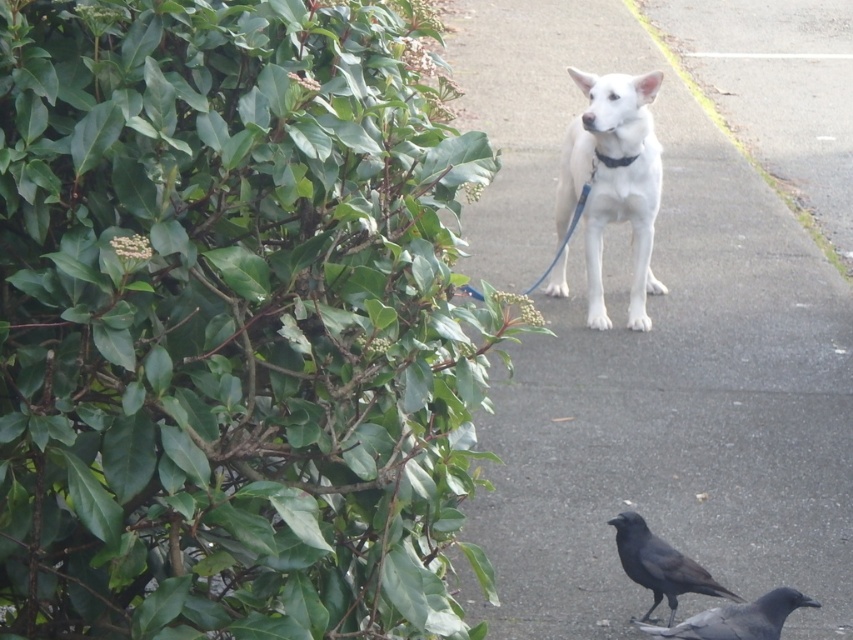
Between green leafy hedge at upper left and gray matte pigeon at lower right, which one appears on the right side from the viewer's perspective?

gray matte pigeon at lower right is more to the right.

Who is more distant from viewer, (415, 227) or (657, 628)?

Positioned behind is point (657, 628).

Is point (4, 416) closer to viewer compared to point (761, 605)?

That is True.

This screenshot has width=853, height=640. I want to click on green leafy hedge at upper left, so click(230, 324).

Does point (268, 598) come closer to viewer compared to point (705, 323)?

Yes, it is.

Between green leafy hedge at upper left and smooth concrete sidewalk at center, which one appears on the left side from the viewer's perspective?

Positioned to the left is green leafy hedge at upper left.

Is point (207, 449) less distant than point (595, 381)?

Yes, it is in front of point (595, 381).

Locate an element on the screen. green leafy hedge at upper left is located at coordinates (230, 324).

Which is behind, point (119, 513) or point (654, 573)?

Point (654, 573)

Can you confirm if green leafy hedge at upper left is wider than shiny black crow at lower right?

Yes, green leafy hedge at upper left is wider than shiny black crow at lower right.

Is point (149, 440) closer to camera compared to point (734, 596)?

Yes, point (149, 440) is closer to viewer.

Find the location of `green leafy hedge at upper left`. green leafy hedge at upper left is located at coordinates (230, 324).